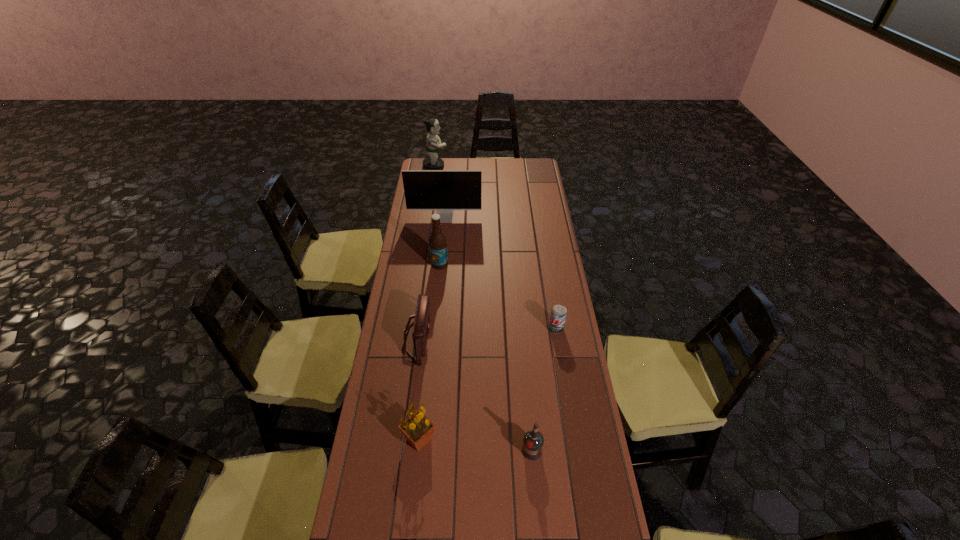
At what (x,y) coordinates should I click in order to perform the action: click on vacant space in between the sunflower and the shoulder bag. Please return your answer as a coordinate pair (x, y). Looking at the image, I should click on (419, 388).

Where is `vacant region between the beer can and the sixth nearest object`? This screenshot has height=540, width=960. vacant region between the beer can and the sixth nearest object is located at coordinates (500, 273).

At what (x,y) coordinates should I click in order to perform the action: click on unoccupied area between the fourth shortest object and the beer bottle. Please return your answer as a coordinate pair (x, y). Looking at the image, I should click on [429, 352].

The height and width of the screenshot is (540, 960). Identify the location of object that can be found as the fifth closest to the farthest object. (417, 428).

Identify the location of object that is the sixth closest to the vodka. The width and height of the screenshot is (960, 540). [x=433, y=142].

You are a GUI agent. You are given a task and a screenshot of the screen. Output one action in this format:
    pyautogui.click(x=<x>, y=<y>)
    Task: Click on the free location that satisfies the following two spatial constraints: 1. on the front-facing side of the monitor; 2. at the front of the sunflower with flowers visible
    
    Given the screenshot: What is the action you would take?
    [x=423, y=439]

In order to click on vacant region that satisfies the following two spatial constraints: 1. on the front-facing side of the sixth nearest object; 2. at the front of the sunflower with flowers visible in this screenshot , I will do `click(423, 439)`.

This screenshot has width=960, height=540. In order to click on vacant space that satisfies the following two spatial constraints: 1. on the front-facing side of the sixth nearest object; 2. on the front flap of the shoulder bag in this screenshot , I will do `click(433, 337)`.